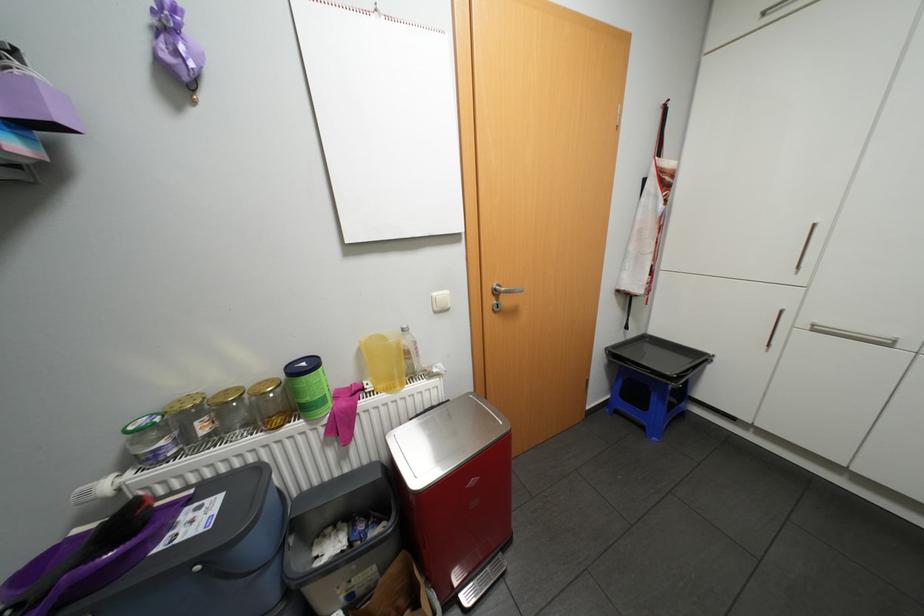
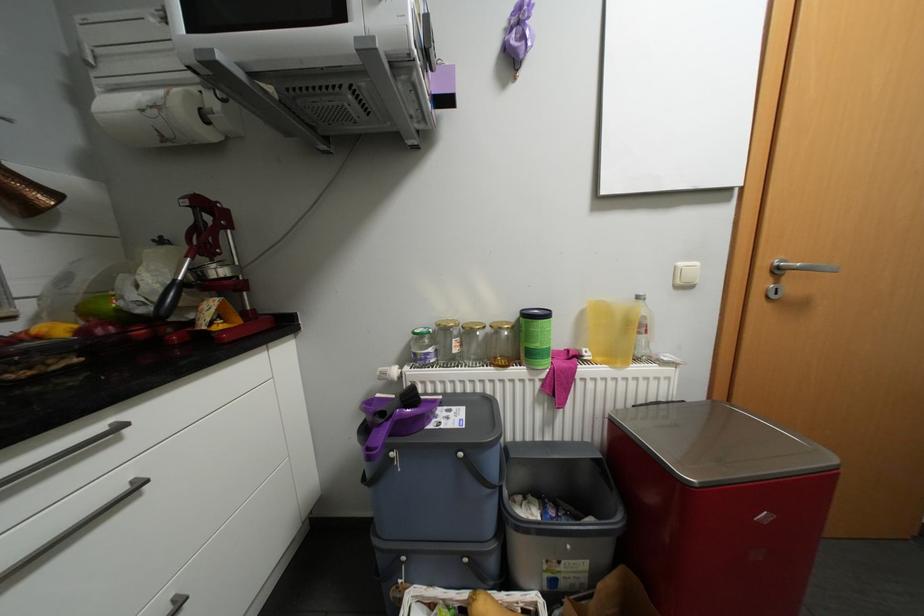
Question: What movement of the cameraman would produce the second image?

Choices:
 (A) Left
 (B) Right
 (C) Forward
 (D) Backward

Answer: (A)